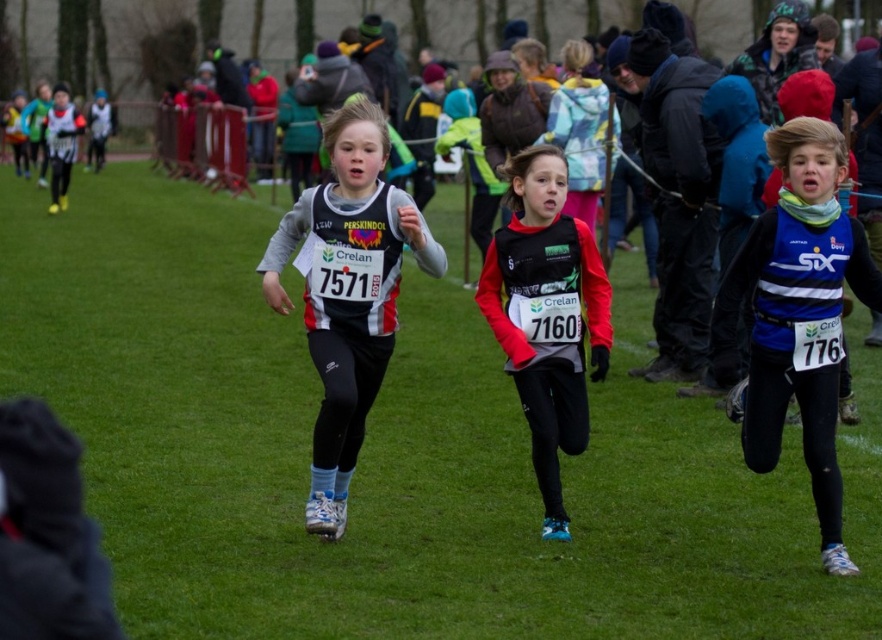
Question: Does black matte vest at center have a larger size compared to matte black vest at center?

Choices:
 (A) no
 (B) yes

Answer: (B)

Question: Is black matte vest at center positioned before black matte jacket at center?

Choices:
 (A) no
 (B) yes

Answer: (B)

Question: Which object is the closest to the matte black vest at center?

Choices:
 (A) black matte vest at center
 (B) blue jersey at center

Answer: (A)

Question: Which point is closer to the camera?

Choices:
 (A) (389, 337)
 (B) (700, 356)
 (C) (495, 339)

Answer: (A)

Question: Does blue jersey at center appear over matte black vest at center?

Choices:
 (A) no
 (B) yes

Answer: (A)

Question: Which object appears farthest from the camera in this image?

Choices:
 (A) matte black vest at center
 (B) black matte jacket at center
 (C) blue jersey at center

Answer: (B)